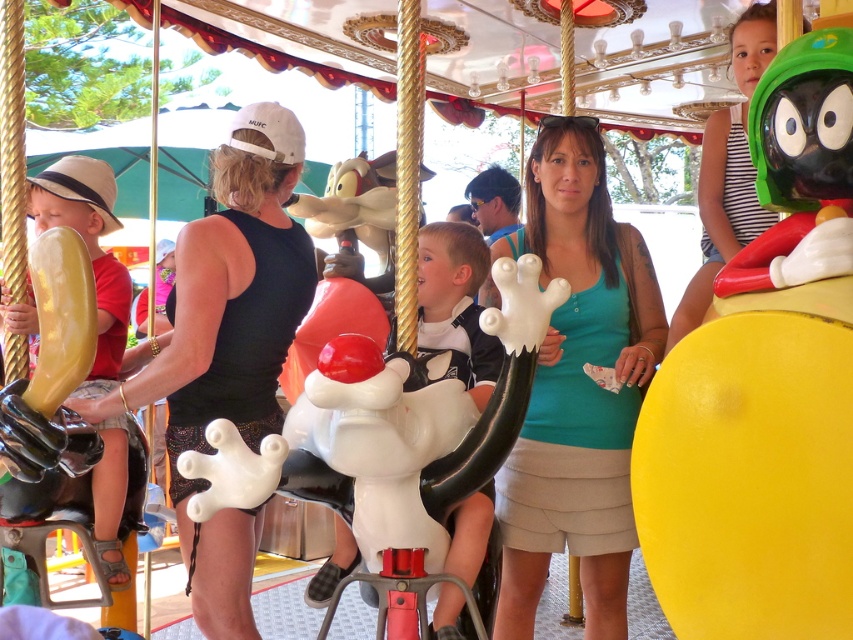
You are a photographer trying to capture a photo of both the green fabric shirt at center and the green matte plush toy at upper right. Since you want both subjects to appear equally sized in your photo, which one should you move closer to the camera?

You should move the green matte plush toy at upper right closer to the camera because the green fabric shirt at center is taller than the green matte plush toy at upper right. By moving the smaller toy forward, their sizes in the photo will appear more balanced.

You are a photographer standing at the front of the carousel. You want to take a picture of the green fabric shirt at center and the yellow matte balloon at left. Based on their positions, which object should you place on the left side of your photo frame?

The yellow matte balloon at left should be placed on the left side of your photo frame because the green fabric shirt at center is to the right of the yellow matte balloon at left.

You are a photographer trying to capture a photo of the green fabric shirt at center and the green matte plush toy at upper right. Which object should you focus on first if you want to ensure both are in the frame without moving the camera?

You should focus on the green fabric shirt at center first because its larger width compared to the green matte plush toy at upper right means it will take up more space in the frame, allowing you to adjust the camera angle to include both objects.